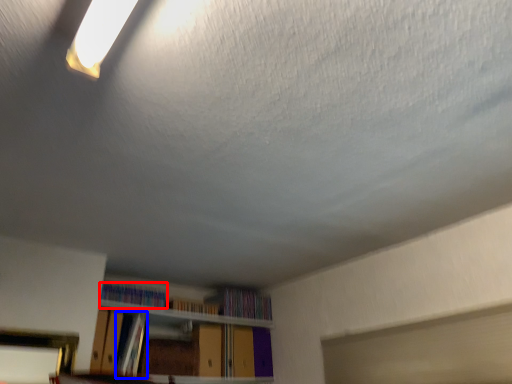
Question: Which point is closer to the camera, book (highlighted by a red box) or book (highlighted by a blue box)?

Choices:
 (A) book
 (B) book

Answer: (B)